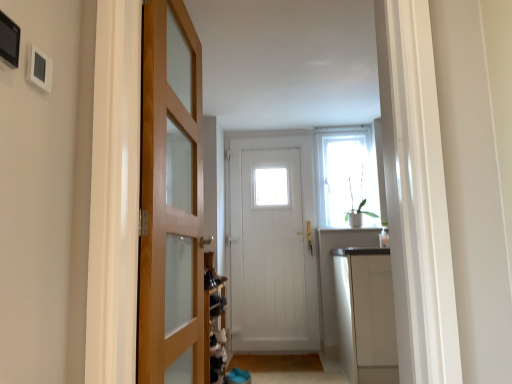
Find the location of a particular element. Image resolution: width=512 pixels, height=384 pixels. vacant space situated above white wooden door at center, marked as the 1th door in a right-to-left arrangement (from a real-world perspective) is located at coordinates (271, 130).